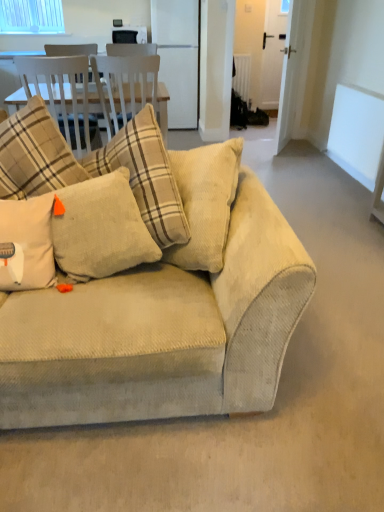
Question: From a real-world perspective, is clear glass window at upper left located higher than beige corduroy pillow at center, which is counted as the second pillow, starting from the right?

Choices:
 (A) no
 (B) yes

Answer: (B)

Question: From the image's perspective, is clear glass window at upper left located beneath beige corduroy pillow at center, the first pillow positioned from the left?

Choices:
 (A) yes
 (B) no

Answer: (B)

Question: Does clear glass window at upper left have a lesser height compared to beige corduroy pillow at center, the first pillow positioned from the left?

Choices:
 (A) yes
 (B) no

Answer: (A)

Question: Is the depth of clear glass window at upper left greater than that of beige corduroy pillow at center, the first pillow positioned from the left?

Choices:
 (A) yes
 (B) no

Answer: (A)

Question: Does clear glass window at upper left have a smaller size compared to beige corduroy pillow at center, the first pillow positioned from the left?

Choices:
 (A) no
 (B) yes

Answer: (B)

Question: Can you confirm if clear glass window at upper left is taller than beige corduroy pillow at center, the first pillow positioned from the left?

Choices:
 (A) yes
 (B) no

Answer: (B)

Question: Does white glossy refrigerator at center have a greater height compared to white matte window screen at upper right?

Choices:
 (A) no
 (B) yes

Answer: (B)

Question: Is white glossy refrigerator at center thinner than white matte window screen at upper right?

Choices:
 (A) no
 (B) yes

Answer: (A)

Question: Can you confirm if white glossy refrigerator at center is bigger than white matte window screen at upper right?

Choices:
 (A) no
 (B) yes

Answer: (B)

Question: From a real-world perspective, is white glossy refrigerator at center on white matte window screen at upper right?

Choices:
 (A) no
 (B) yes

Answer: (B)

Question: Is white glossy refrigerator at center to the left of white matte window screen at upper right from the viewer's perspective?

Choices:
 (A) yes
 (B) no

Answer: (A)

Question: Are white glossy refrigerator at center and white matte window screen at upper right located far from each other?

Choices:
 (A) yes
 (B) no

Answer: (A)

Question: Does beige corduroy pillow at center, the first pillow positioned from the left, appear on the left side of beige corduroy couch at center?

Choices:
 (A) yes
 (B) no

Answer: (A)